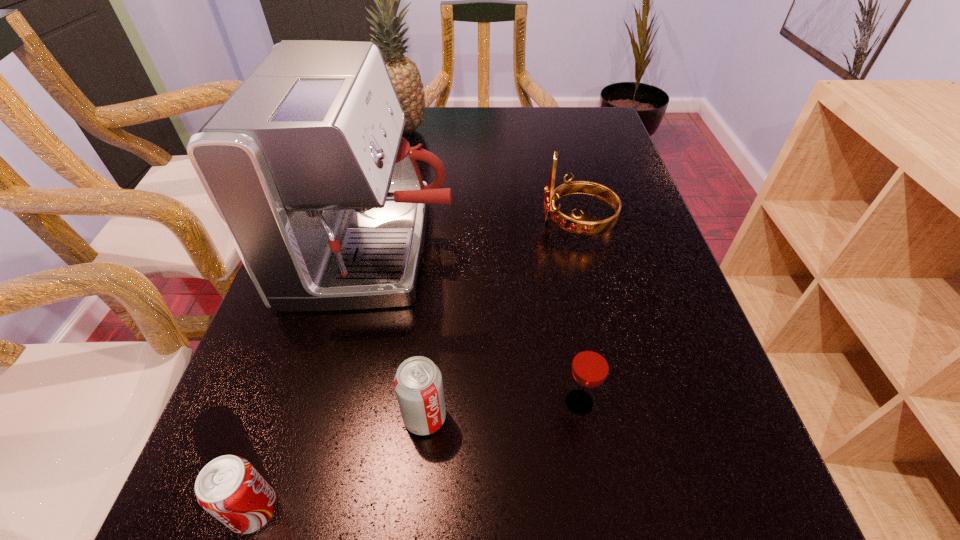
Identify the location of free point located 0.390m on the front-facing side of the tiara. (374, 223).

You are a GUI agent. You are given a task and a screenshot of the screen. Output one action in this format:
    pyautogui.click(x=<x>, y=<y>)
    Task: Click on the free space located on the front-facing side of the tiara
    The height and width of the screenshot is (540, 960).
    Given the screenshot: What is the action you would take?
    pyautogui.click(x=370, y=223)

This screenshot has width=960, height=540. What are the coordinates of `free space located on the left of the glass` in the screenshot? It's located at (532, 402).

Locate an element on the screen. The image size is (960, 540). vacant space located 0.070m on the right of the right soda can is located at coordinates (491, 417).

Locate an element on the screen. This screenshot has height=540, width=960. vacant space positioned 0.210m on the back of the nearest object is located at coordinates (303, 360).

This screenshot has width=960, height=540. Find the location of `object located at the far edge`. object located at the far edge is located at coordinates click(405, 76).

Locate an element on the screen. The image size is (960, 540). object that is at the near edge is located at coordinates (229, 488).

This screenshot has height=540, width=960. In order to click on pineapple situated at the left edge in this screenshot , I will do `click(405, 76)`.

Locate an element on the screen. Image resolution: width=960 pixels, height=540 pixels. coffee maker positioned at the left edge is located at coordinates (305, 164).

Find the location of `soda can located in the left edge section of the desktop`. soda can located in the left edge section of the desktop is located at coordinates (229, 488).